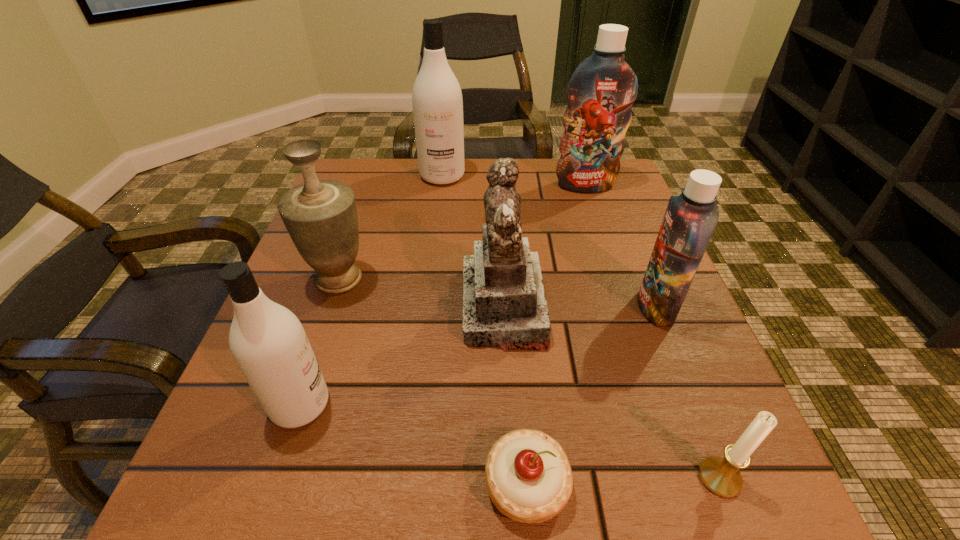
I want to click on the right white shampoo, so click(x=437, y=102).

Identify the location of the sixth object from right to left. (437, 102).

Identify the location of the bigger blue shampoo. (601, 91).

Locate an element on the screen. figurine is located at coordinates (504, 305).

You are a GUI agent. You are given a task and a screenshot of the screen. Output one action in this format:
    pyautogui.click(x=<x>, y=<y>)
    Task: Click on the urn
    The image size is (960, 540).
    Given the screenshot: What is the action you would take?
    [x=320, y=216]

Find the location of `the smaller blue shampoo`. the smaller blue shampoo is located at coordinates (690, 219).

In order to click on the third farthest shampoo in this screenshot , I will do `click(690, 219)`.

You are a GUI agent. You are given a task and a screenshot of the screen. Output one action in this format:
    pyautogui.click(x=<x>, y=<y>)
    Task: Click on the third nearest object
    
    Given the screenshot: What is the action you would take?
    pyautogui.click(x=268, y=342)

Where is `the left white shampoo`? The width and height of the screenshot is (960, 540). the left white shampoo is located at coordinates (268, 342).

Find the location of a particular element. Image resolution: width=960 pixels, height=540 pixels. the second shortest object is located at coordinates (x=721, y=476).